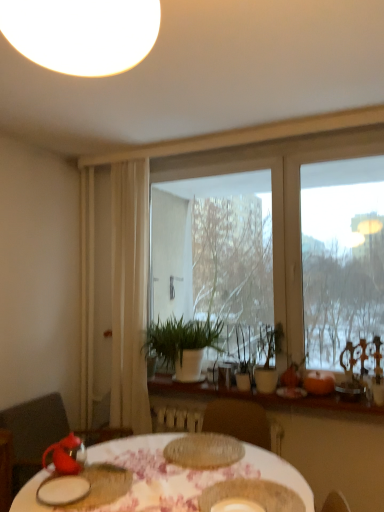
Locate an element on the screen. vacant area that is situated to the right of matte red teapot at lower left, positioned as the first tableware in left-to-right order is located at coordinates (115, 474).